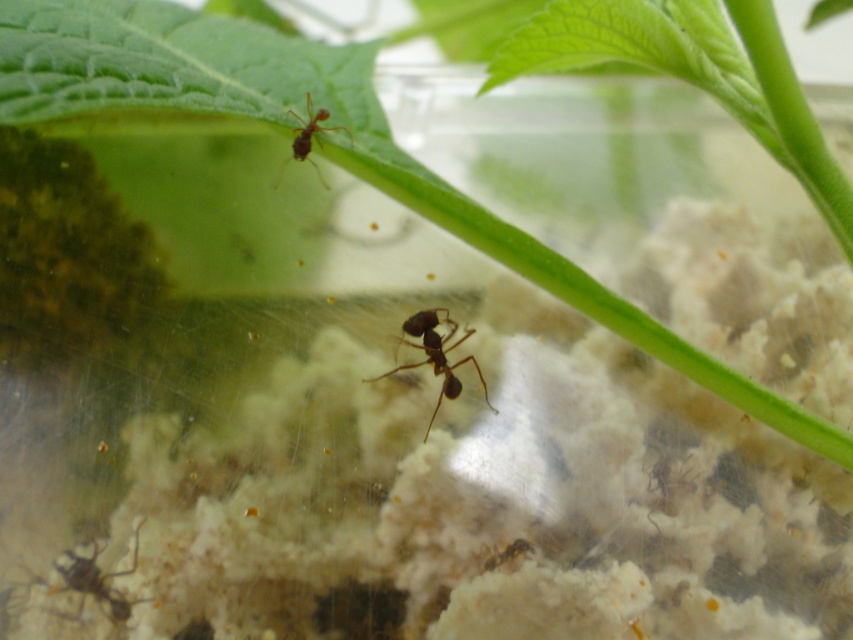
This screenshot has width=853, height=640. Describe the element at coordinates (436, 355) in the screenshot. I see `shiny brown ant at center` at that location.

Looking at this image, which is above, shiny brown ant at center or brown matte ant at lower left?

shiny brown ant at center is higher up.

Locate an element on the screen. This screenshot has height=640, width=853. shiny brown ant at center is located at coordinates (436, 355).

Is the position of shiny brown ant at center less distant than that of brown matte ant at upper center?

That is False.

Is shiny brown ant at center bigger than brown matte ant at upper center?

Actually, shiny brown ant at center might be smaller than brown matte ant at upper center.

Find the location of a particular element. shiny brown ant at center is located at coordinates (436, 355).

Who is shorter, brown matte ant at lower left or brown matte ant at upper center?

brown matte ant at upper center

Which is more to the right, brown matte ant at lower left or brown matte ant at upper center?

From the viewer's perspective, brown matte ant at upper center appears more on the right side.

Is point (84, 577) in front of point (312, 132)?

Yes, point (84, 577) is closer to viewer.

You are a GUI agent. You are given a task and a screenshot of the screen. Output one action in this format:
    pyautogui.click(x=<x>, y=<y>)
    Task: Click on the brown matte ant at lower left
    
    Given the screenshot: What is the action you would take?
    [96, 582]